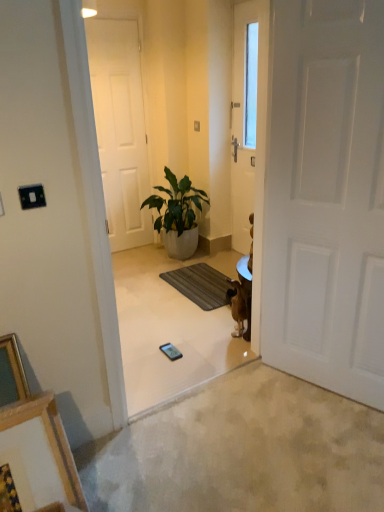
Locate an element on the screen. The image size is (384, 512). free space to the left of white matte door at right, the 1th door viewed from the right is located at coordinates (262, 401).